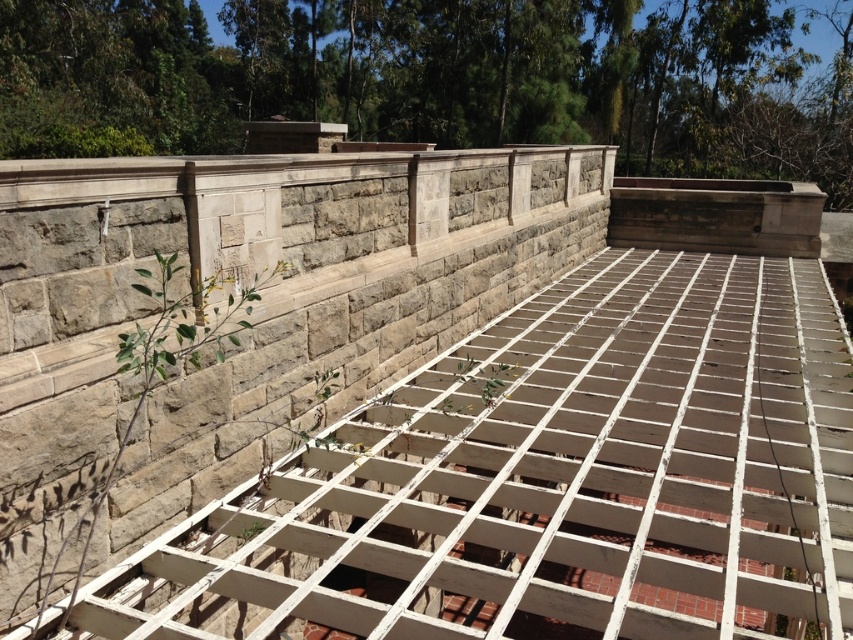
Question: Among these points, which one is farthest from the camera?

Choices:
 (A) (38, 308)
 (B) (193, 364)

Answer: (B)

Question: Observing the image, what is the correct spatial positioning of gray stone wall at upper center in reference to green leafy plant at left?

Choices:
 (A) right
 (B) left

Answer: (A)

Question: Among these points, which one is farthest from the camera?

Choices:
 (A) (32, 461)
 (B) (120, 436)

Answer: (B)

Question: Is gray stone wall at upper center to the left of green leafy plant at left from the viewer's perspective?

Choices:
 (A) yes
 (B) no

Answer: (B)

Question: Is gray stone wall at upper center to the left of green leafy plant at left from the viewer's perspective?

Choices:
 (A) no
 (B) yes

Answer: (A)